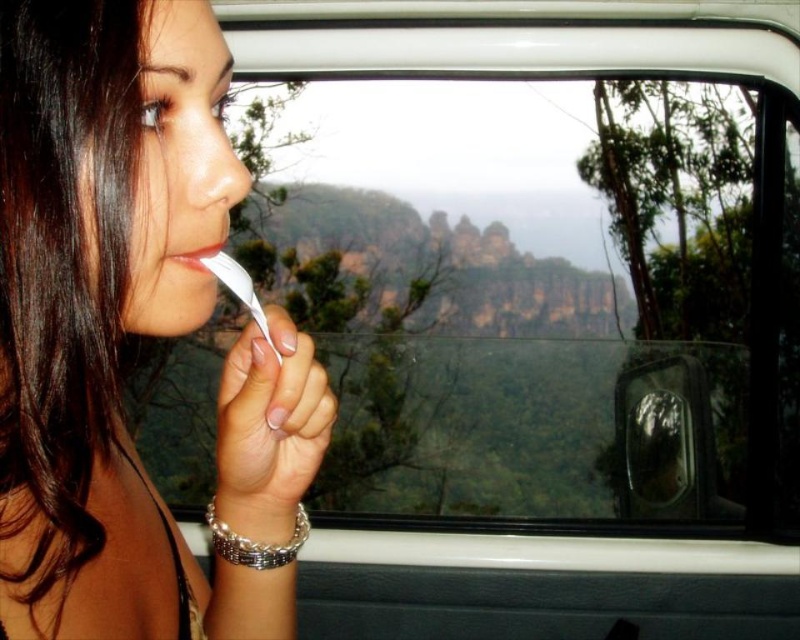
Does matte white feather at center have a greater width compared to matte white toothbrush at lower left?

Yes.

Which is in front, point (160, 634) or point (202, 250)?

Positioned in front is point (202, 250).

Where is `matte white feather at center`? The image size is (800, 640). matte white feather at center is located at coordinates (132, 333).

Between transparent glass car window at center and matte white toothbrush at lower left, which one appears on the right side from the viewer's perspective?

Positioned to the right is transparent glass car window at center.

Does transparent glass car window at center have a greater height compared to matte white toothbrush at lower left?

Correct, transparent glass car window at center is much taller as matte white toothbrush at lower left.

Is point (316, 160) positioned before point (192, 259)?

No, it is not.

Locate an element on the screen. transparent glass car window at center is located at coordinates (536, 296).

Does transparent glass car window at center appear under matte white feather at center?

No, transparent glass car window at center is not below matte white feather at center.

Is transparent glass car window at center shorter than matte white feather at center?

In fact, transparent glass car window at center may be taller than matte white feather at center.

Does point (314, 317) lie in front of point (168, 161)?

That is False.

Find the location of a particular element. The width and height of the screenshot is (800, 640). transparent glass car window at center is located at coordinates (536, 296).